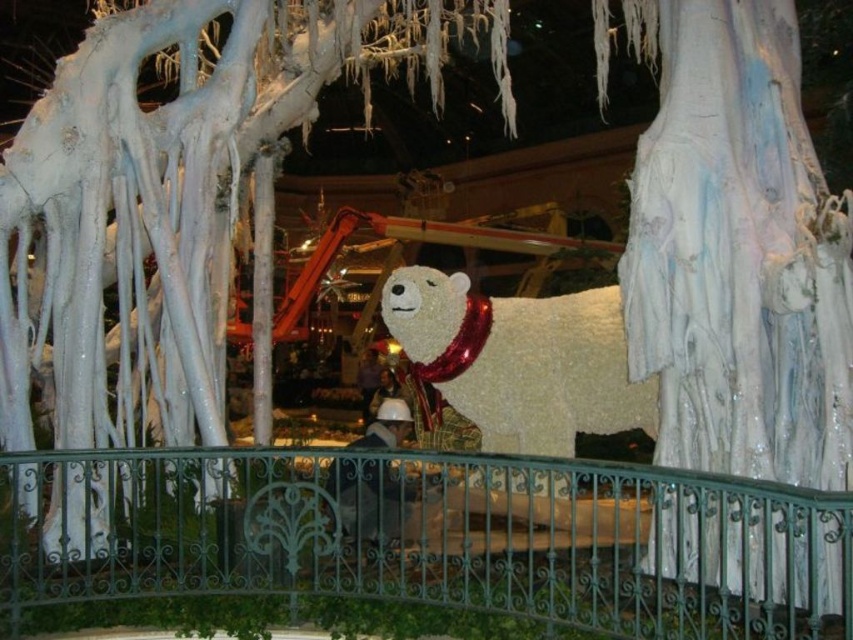
Is point (744, 516) farther from camera compared to point (489, 400)?

No, (744, 516) is closer to viewer.

Who is more forward, [282,531] or [442,276]?

Point [282,531] is in front.

The height and width of the screenshot is (640, 853). I want to click on green wrought iron railing at center, so click(x=433, y=536).

You are a GUI agent. You are given a task and a screenshot of the screen. Output one action in this format:
    pyautogui.click(x=<x>, y=<y>)
    Task: Click on the green wrought iron railing at center
    Image resolution: width=853 pixels, height=640 pixels.
    Given the screenshot: What is the action you would take?
    pyautogui.click(x=433, y=536)